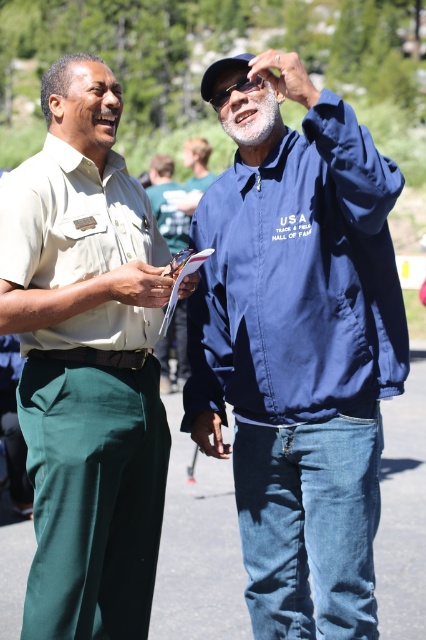
You are a photographer trying to capture a clear shot of both the matte khaki shirt at left and the blue matte jacket at center. However, you notice that one of them is blocking the other. Which object is covering part of the other?

The matte khaki shirt at left is positioned over blue matte jacket at center, so the matte khaki shirt at left is covering part of the blue matte jacket at center.

You are trying to determine which jacket is visible on top in the image. The jackets are the blue fabric jacket at upper right and the blue matte jacket at center. According to the scene description, which one is on top?

The blue fabric jacket at upper right is positioned over the blue matte jacket at center, so it is visible on top.

You are a tailor who needs to determine which garment requires more fabric for alterations. Based on the scene, which item between the blue fabric jacket at upper right and the matte khaki shirt at left would need more fabric due to its size?

The blue fabric jacket at upper right requires more fabric for alterations because its width is larger than the matte khaki shirt at left.